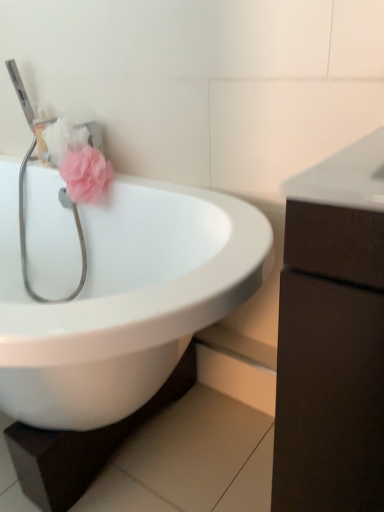
Question: In the image, is white glossy sink at center positioned in front of or behind pink fabric flower at upper left?

Choices:
 (A) behind
 (B) front

Answer: (B)

Question: From a real-world perspective, is white glossy sink at center physically located above or below pink fabric flower at upper left?

Choices:
 (A) below
 (B) above

Answer: (A)

Question: Which of these objects is positioned closest to the pink fabric flower at upper left?

Choices:
 (A) dark brown wood cabinet at right
 (B) metallic silver stethoscope at left
 (C) white glossy sink at center

Answer: (B)

Question: Considering the real-world distances, which object is closest to the pink fabric flower at upper left?

Choices:
 (A) dark brown wood cabinet at right
 (B) metallic silver stethoscope at left
 (C) white glossy sink at center

Answer: (B)